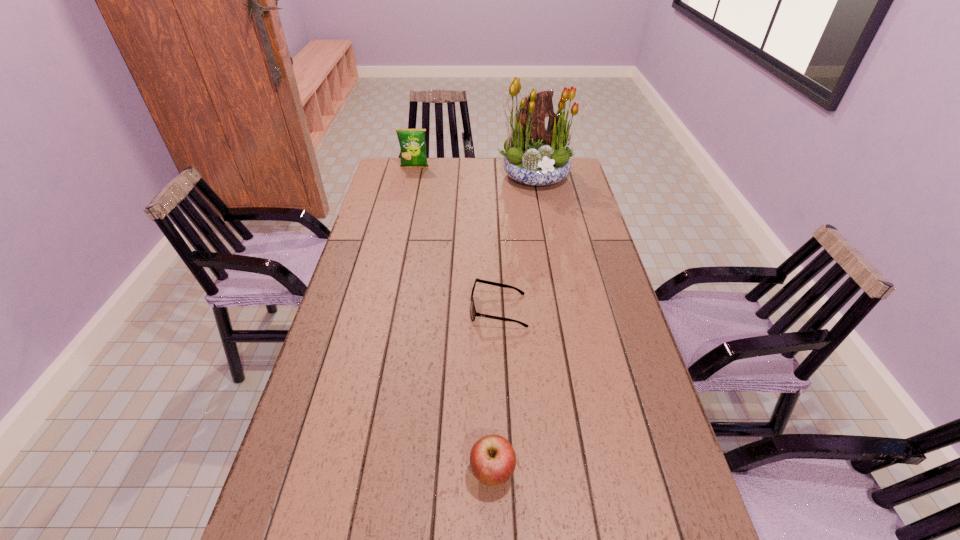
Identify the location of flower arrangement. (535, 155).

I want to click on the leftmost object, so click(412, 142).

At what (x,y) coordinates should I click in order to perform the action: click on crisp (potato chip). Please return your answer as a coordinate pair (x, y). Looking at the image, I should click on (412, 142).

In order to click on the third tallest object in this screenshot , I will do `click(492, 458)`.

Locate an element on the screen. The image size is (960, 540). the nearest object is located at coordinates (492, 458).

Where is `the shortest object`? Image resolution: width=960 pixels, height=540 pixels. the shortest object is located at coordinates (473, 313).

Where is `sunglasses`? The width and height of the screenshot is (960, 540). sunglasses is located at coordinates (473, 313).

Where is `vacant space located 0.400m on the front-facing side of the tallest object`? This screenshot has height=540, width=960. vacant space located 0.400m on the front-facing side of the tallest object is located at coordinates (553, 258).

Identify the location of blank area located 0.370m on the front-facing side of the second tallest object. This screenshot has width=960, height=540. (403, 219).

This screenshot has width=960, height=540. Identify the location of free space located on the back of the second shortest object. (491, 400).